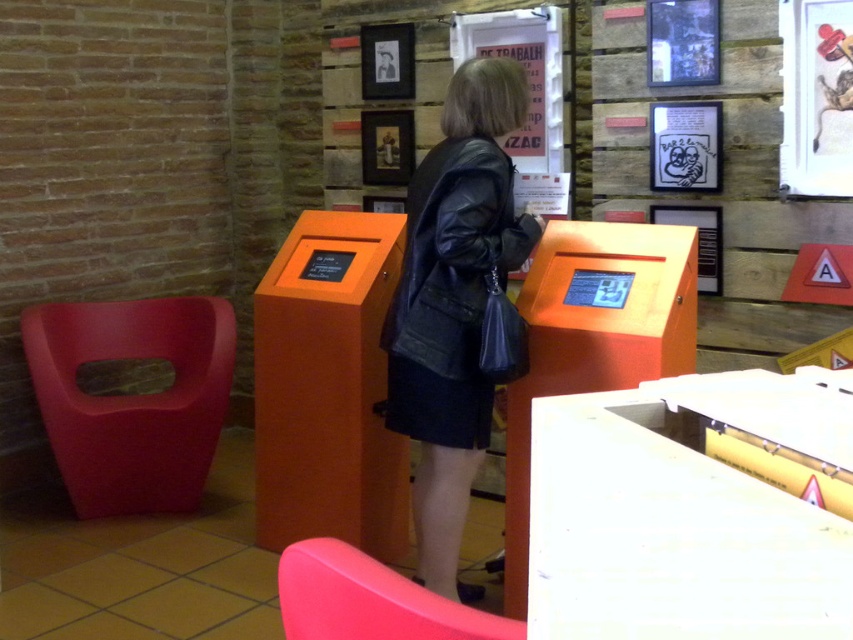
Is point (440, 273) closer to camera compared to point (671, 61)?

That is True.

Does black leather jacket at center lie in front of matte black poster at upper center?

Yes, it is.

At what (x,y) coordinates should I click in order to perform the action: click on black leather jacket at center. Please return your answer as a coordinate pair (x, y). The width and height of the screenshot is (853, 640). Looking at the image, I should click on (454, 304).

Is matte plastic chair at left to the left of matte plastic chair at lower left from the viewer's perspective?

Correct, you'll find matte plastic chair at left to the left of matte plastic chair at lower left.

What are the coordinates of `matte plastic chair at left` in the screenshot? It's located at (132, 397).

In order to click on matte plastic chair at left in this screenshot , I will do `click(132, 397)`.

Where is `matte plastic chair at left`? The image size is (853, 640). matte plastic chair at left is located at coordinates (132, 397).

The image size is (853, 640). What do you see at coordinates (132, 397) in the screenshot?
I see `matte plastic chair at left` at bounding box center [132, 397].

Who is more forward, [171,417] or [711,1]?

Point [711,1]

You are a GUI agent. You are given a task and a screenshot of the screen. Output one action in this format:
    pyautogui.click(x=<x>, y=<y>)
    Task: Click on the matte plastic chair at left
    
    Given the screenshot: What is the action you would take?
    pyautogui.click(x=132, y=397)